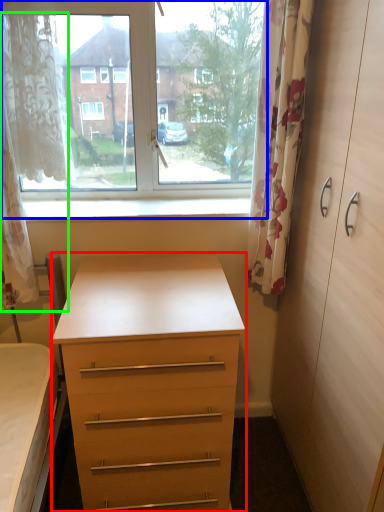
Question: Which object is the closest to the chest of drawers (highlighted by a red box)? Choose among these: window (highlighted by a blue box) or curtain (highlighted by a green box).

Choices:
 (A) window
 (B) curtain

Answer: (A)